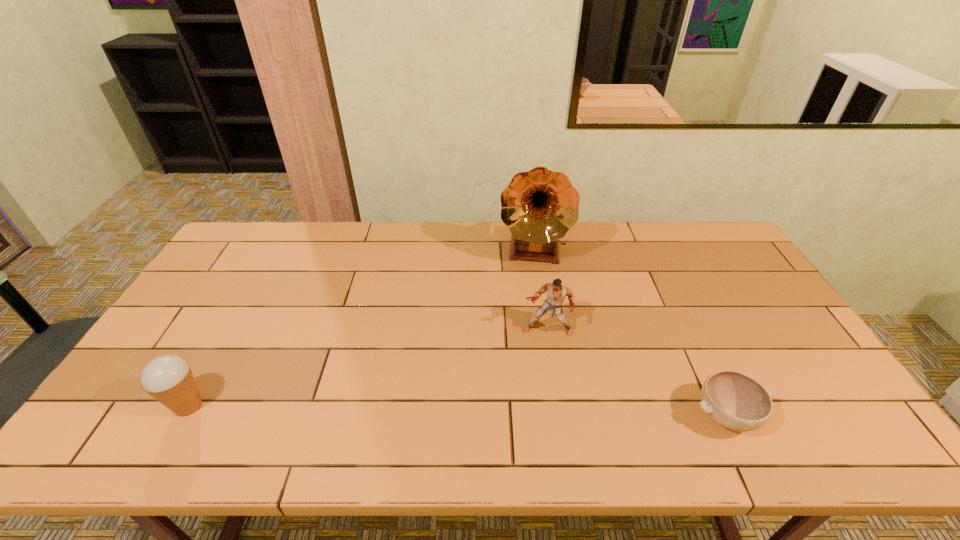
At what (x,y) coordinates should I click in order to perform the action: click on icecream. Please return your answer as a coordinate pair (x, y). This screenshot has height=540, width=960. Looking at the image, I should click on (169, 379).

I want to click on the rightmost object, so click(x=736, y=401).

Locate an element on the screen. Image resolution: width=960 pixels, height=540 pixels. the shortest object is located at coordinates (736, 401).

At what (x,y) coordinates should I click in order to perform the action: click on puncher. Please return your answer as a coordinate pair (x, y). The image size is (960, 540). Looking at the image, I should click on [x=556, y=292].

This screenshot has width=960, height=540. In order to click on the farthest object in this screenshot , I will do `click(539, 207)`.

Identify the location of the tallest object. This screenshot has width=960, height=540. (539, 207).

Find the location of `vacant space located on the right of the leftmost object`. vacant space located on the right of the leftmost object is located at coordinates (340, 406).

At what (x,y) coordinates should I click in order to perform the action: click on vacant space located 0.140m on the back of the shortest object. Please return your answer as a coordinate pair (x, y). Image resolution: width=960 pixels, height=540 pixels. Looking at the image, I should click on (693, 347).

Identify the location of free space located 0.050m on the front-facing side of the puncher. The image size is (960, 540). click(x=538, y=352).

Where is `vacant space located on the front-facing side of the puncher`? vacant space located on the front-facing side of the puncher is located at coordinates (535, 363).